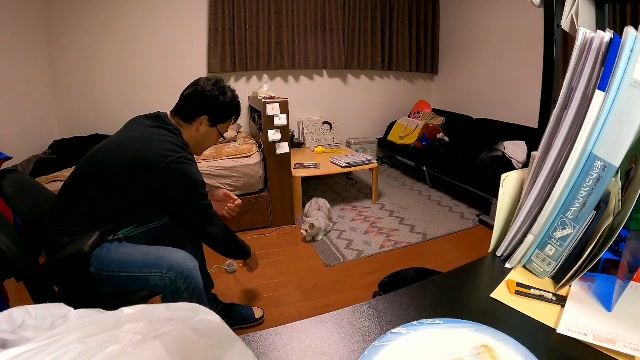
Where is `beige rug`? This screenshot has width=640, height=360. beige rug is located at coordinates (418, 206).